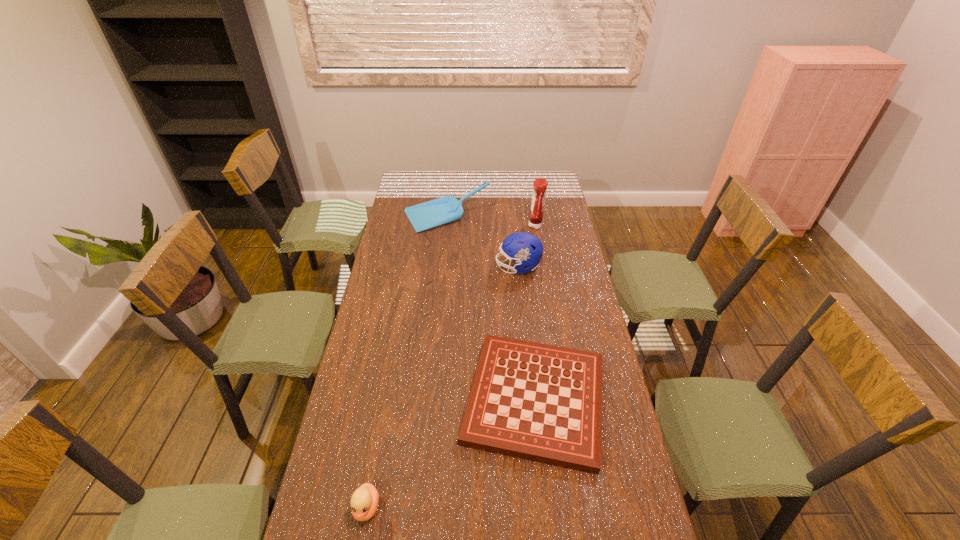
This screenshot has height=540, width=960. In order to click on condiment in this screenshot , I will do `click(540, 185)`.

I want to click on football helmet, so coord(525,249).

Where is `the third nearest object`? the third nearest object is located at coordinates (525, 249).

Where is `dustpan`? dustpan is located at coordinates [x=446, y=209].

Find the location of a particular element. The width and height of the screenshot is (960, 540). the nearest object is located at coordinates (364, 502).

Locate an element on the screen. duckling is located at coordinates (364, 502).

Find the location of a particular element. gameboard is located at coordinates (541, 402).

Locate an element on the screen. This screenshot has height=540, width=960. the shortest object is located at coordinates (541, 402).

Locate an element on the screen. The image size is (960, 540). blank area located on the right of the tallest object is located at coordinates (566, 226).

You are a GUI agent. You are given a task and a screenshot of the screen. Output one action in this format:
    pyautogui.click(x=<x>, y=<y>)
    Task: Click on the vacant space located 0.130m on the face guard of the football helmet
    The height and width of the screenshot is (540, 960).
    Given the screenshot: What is the action you would take?
    pyautogui.click(x=466, y=267)